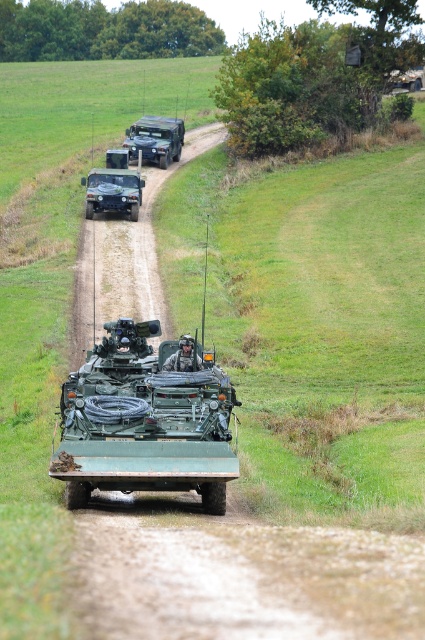
Who is more forward, (161, 364) or (112, 177)?

Point (161, 364) is in front.

This screenshot has height=640, width=425. In order to click on green matte tank at center in this screenshot , I will do `click(146, 419)`.

Consider the image. Who is shorter, matte green jeep at center or matte green military vehicle at center?

With less height is matte green jeep at center.

What are the coordinates of `matte green jeep at center` in the screenshot? It's located at click(113, 192).

Where is `matte green jeep at center`? matte green jeep at center is located at coordinates (113, 192).

Is green matte tank at center shorter than matte green military vehicle at center?

Correct, green matte tank at center is not as tall as matte green military vehicle at center.

Is point (96, 481) behind point (172, 128)?

No.

The image size is (425, 640). What do you see at coordinates (146, 419) in the screenshot? I see `green matte tank at center` at bounding box center [146, 419].

Where is `green matte tank at center`? The height and width of the screenshot is (640, 425). green matte tank at center is located at coordinates (146, 419).